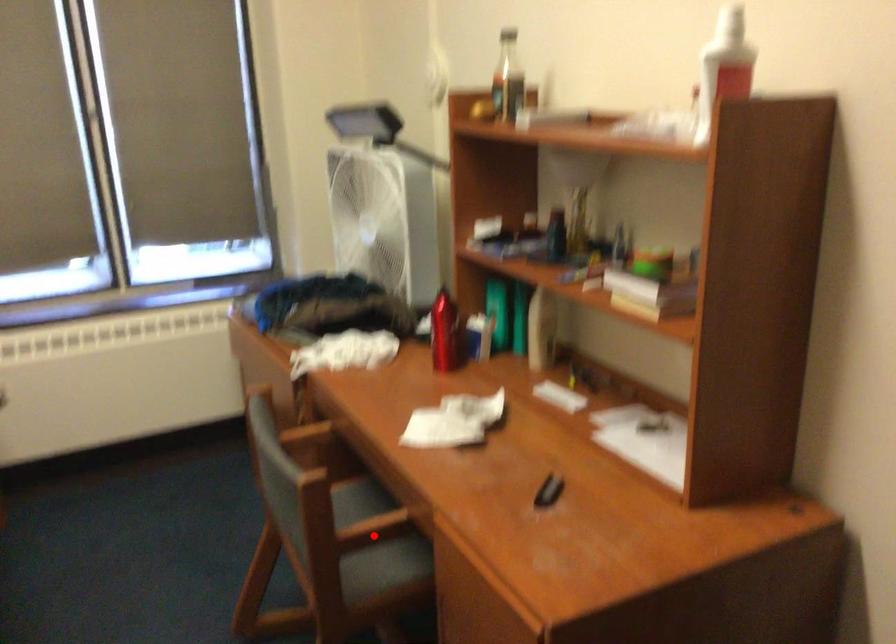
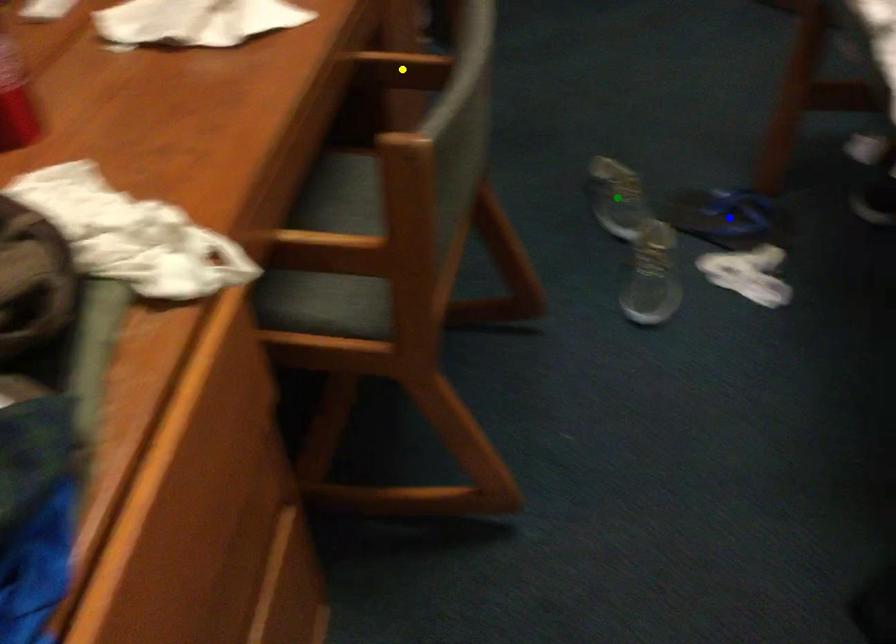
Question: I am providing you with two images of the same scene from different viewpoints. A red point is marked on the first image. You are given multiple points on the second image. Can you choose the point in image 2 that corresponds to the point in image 1?

Choices:
 (A) green point
 (B) yellow point
 (C) blue point

Answer: (B)